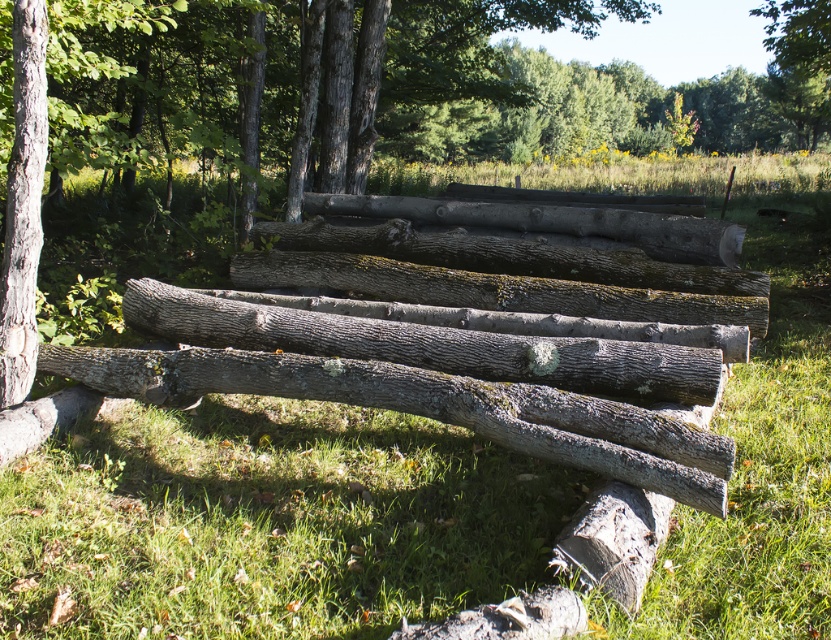
Does smooth bark logs at center have a larger size compared to smooth brown tree trunk at left?

Indeed, smooth bark logs at center has a larger size compared to smooth brown tree trunk at left.

Which is behind, point (485, 86) or point (16, 154)?

The point (485, 86) is behind.

Is point (428, 72) in front of point (28, 378)?

No, it is behind (28, 378).

Where is `smooth bark logs at center`? smooth bark logs at center is located at coordinates (455, 58).

Between point (15, 266) and point (460, 208), which one is positioned in front?

Point (15, 266) is more forward.

Can you confirm if smooth bark logs at center is positioned below gray rough wood log at center?

Actually, smooth bark logs at center is above gray rough wood log at center.

This screenshot has width=831, height=640. Describe the element at coordinates (455, 58) in the screenshot. I see `smooth bark logs at center` at that location.

Where is `smooth bark logs at center`? smooth bark logs at center is located at coordinates (455, 58).

Between smooth brown tree trunk at left and gray rough wood log at center, which one appears on the right side from the viewer's perspective?

gray rough wood log at center is more to the right.

Which is behind, point (8, 208) or point (682, 243)?

The point (682, 243) is more distant.

Is point (6, 321) closer to viewer compared to point (704, 224)?

Yes, point (6, 321) is in front of point (704, 224).

The width and height of the screenshot is (831, 640). I want to click on smooth brown tree trunk at left, so click(x=23, y=202).